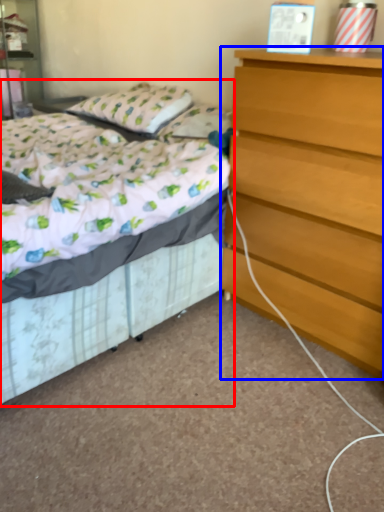
Question: Which object is closer to the camera taking this photo, bed (highlighted by a red box) or chest of drawers (highlighted by a blue box)?

Choices:
 (A) bed
 (B) chest of drawers

Answer: (A)